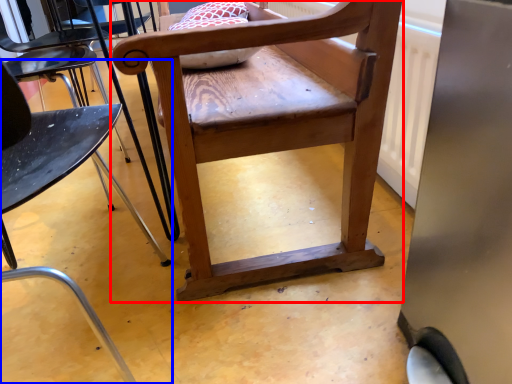
Question: Among these objects, which one is farthest to the camera, chair (highlighted by a red box) or chair (highlighted by a blue box)?

Choices:
 (A) chair
 (B) chair

Answer: (A)